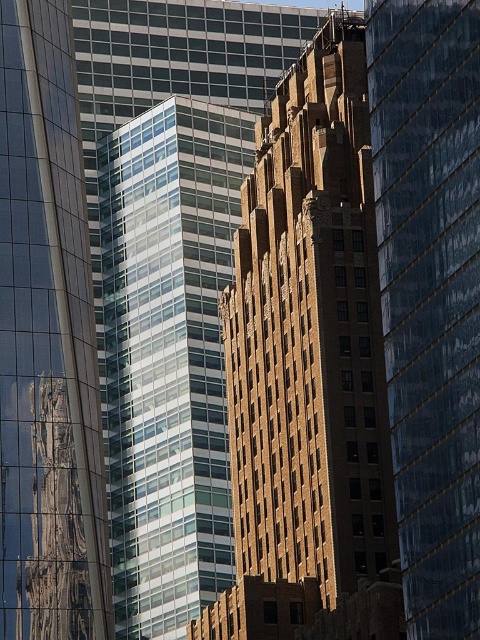
The image size is (480, 640). What do you see at coordinates (431, 294) in the screenshot?
I see `brown brick building at center` at bounding box center [431, 294].

Is brown brick building at center below glassy reflective skyscraper at left?

Actually, brown brick building at center is above glassy reflective skyscraper at left.

Identify the location of brown brick building at center. This screenshot has width=480, height=640. (431, 294).

At what (x,y) coordinates should I click in order to perform the action: click on brown brick building at center. Please return your answer as a coordinate pair (x, y). The image size is (480, 640). Looking at the image, I should click on (431, 294).